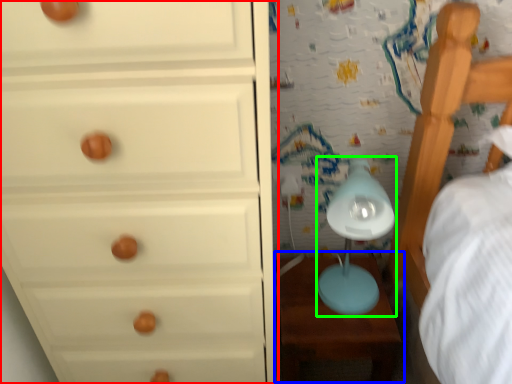
Question: Estimate the real-world distances between objects in this image. Which object is closer to chest of drawers (highlighted by a red box), table (highlighted by a blue box) or table lamp (highlighted by a green box)?

Choices:
 (A) table
 (B) table lamp

Answer: (B)